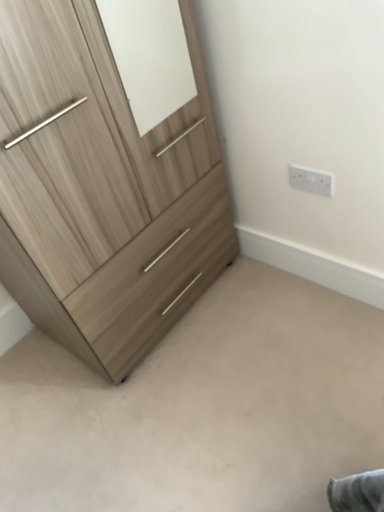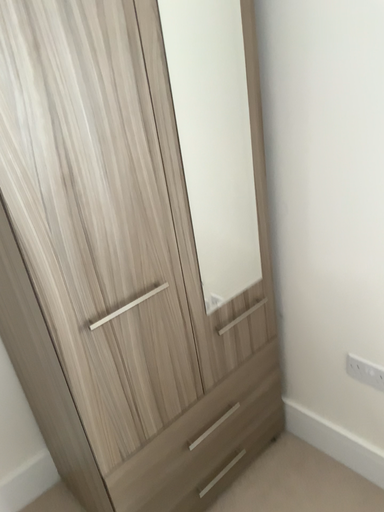
Question: How did the camera likely rotate when shooting the video?

Choices:
 (A) rotated upward
 (B) rotated downward

Answer: (A)